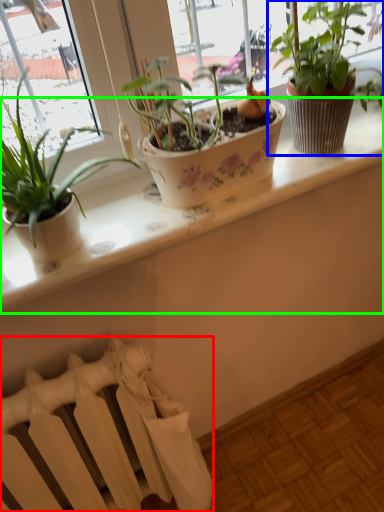
Question: Which object is positioned farthest from radiator (highlighted by a red box)? Select from houseplant (highlighted by a blue box) and window sill (highlighted by a green box).

Choices:
 (A) houseplant
 (B) window sill

Answer: (A)